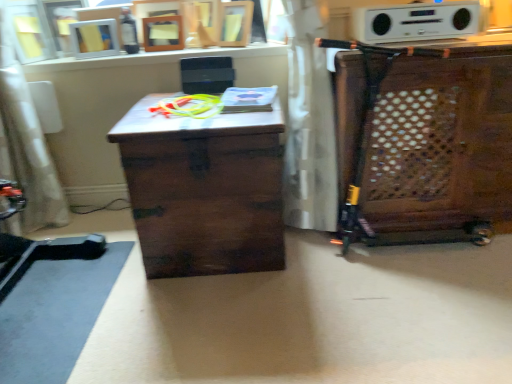
The width and height of the screenshot is (512, 384). Identify the location of vacant region to the left of dark wood trunk at center. (84, 269).